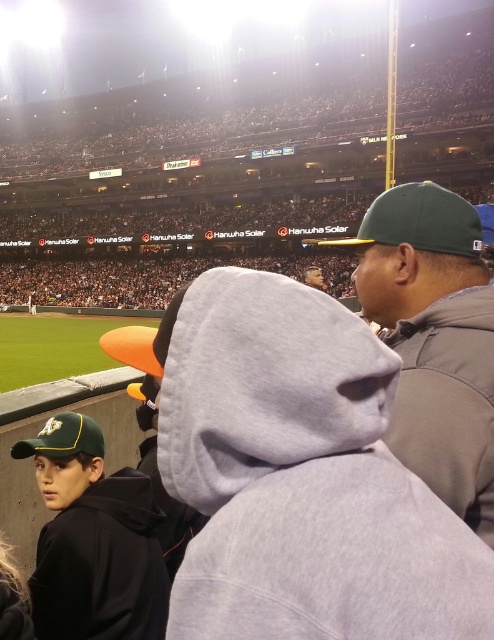
You are a photographer trying to capture a clear shot of the baseball game. You notice two green caps in the image. The green fabric cap at upper right and the green matte baseball cap at lower left. Which cap is wider?

The green fabric cap at upper right might be wider than the green matte baseball cap at lower left according to the description.

You are a photographer at the baseball stadium trying to capture a clear shot of both the green fabric cap at upper right and the green matte baseball cap at lower left. Which cap will appear taller in your photo?

The green fabric cap at upper right will appear taller in the photo because it is taller than the green matte baseball cap at lower left according to the description.